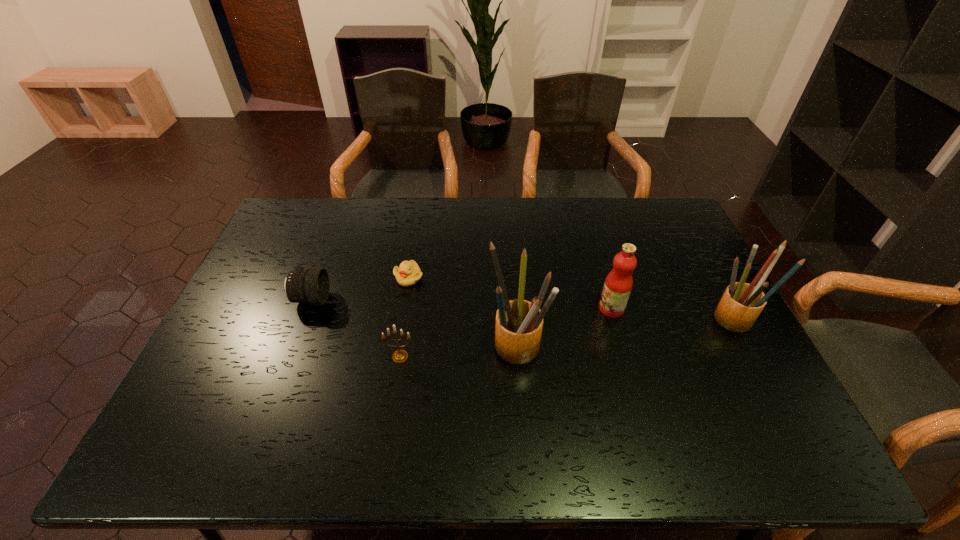
I want to click on vacant space positioned 0.090m on the left of the rightmost object, so click(x=681, y=322).

In order to click on free space located on the left of the candelabrum in this screenshot , I will do `click(246, 356)`.

At what (x,y) coordinates should I click in order to perform the action: click on vacant space located at the front element of the leftmost object. Please return your answer as a coordinate pair (x, y). Looking at the image, I should click on point(420,300).

I want to click on free space located 0.220m on the front label of the fruit juice, so click(523, 309).

The image size is (960, 540). I want to click on free space located on the front label of the fruit juice, so click(540, 309).

This screenshot has height=540, width=960. Find the location of `free space located 0.210m on the front label of the fruit juice`. free space located 0.210m on the front label of the fruit juice is located at coordinates (526, 309).

Find the location of a particular element. The height and width of the screenshot is (540, 960). blank space located at the face of the duckling is located at coordinates (396, 355).

Image resolution: width=960 pixels, height=540 pixels. In order to click on object located in the right edge section of the desktop in this screenshot , I will do `click(741, 304)`.

The image size is (960, 540). Identify the location of vacant position at the far edge of the desktop. (545, 217).

Where is `vacant space at the left edge`? The height and width of the screenshot is (540, 960). vacant space at the left edge is located at coordinates pos(262,255).